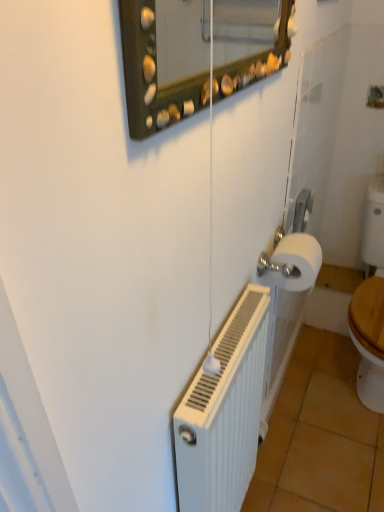
Question: From the image's perspective, is white ribbed radiator at lower right positioned above or below orange tile at lower right?

Choices:
 (A) below
 (B) above

Answer: (B)

Question: Based on their sizes in the image, would you say white ribbed radiator at lower right is bigger or smaller than orange tile at lower right?

Choices:
 (A) small
 (B) big

Answer: (B)

Question: Based on their relative distances, which object is nearer to the orange tile at lower right?

Choices:
 (A) white ribbed radiator at lower right
 (B) white matte toilet paper at right

Answer: (A)

Question: Which object is positioned closest to the white ribbed radiator at lower right?

Choices:
 (A) orange tile at lower right
 (B) white matte toilet paper at right

Answer: (B)